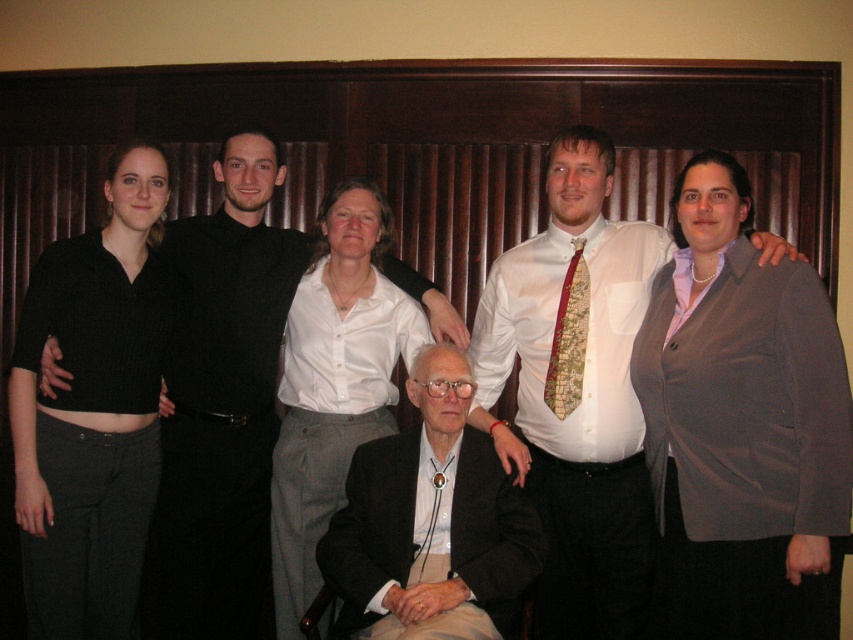
Does matte white shirt at center lie in front of gold-patterned fabric tie at center?

Yes, it is.

Who is more forward, (590, 339) or (567, 291)?

Point (590, 339)

Identify the location of matte white shirt at center. (575, 390).

Is matte white shirt at center taller than black leather suit at center?

Correct, matte white shirt at center is much taller as black leather suit at center.

The height and width of the screenshot is (640, 853). What do you see at coordinates (575, 390) in the screenshot? I see `matte white shirt at center` at bounding box center [575, 390].

Between point (646, 556) and point (444, 604), which one is positioned behind?

The point (646, 556) is more distant.

In order to click on matte white shirt at center in this screenshot , I will do `click(575, 390)`.

Image resolution: width=853 pixels, height=640 pixels. Describe the element at coordinates (334, 381) in the screenshot. I see `white shirt at center` at that location.

Identify the location of white shirt at center. (x=334, y=381).

The image size is (853, 640). Find the location of `white shirt at center`. white shirt at center is located at coordinates (334, 381).